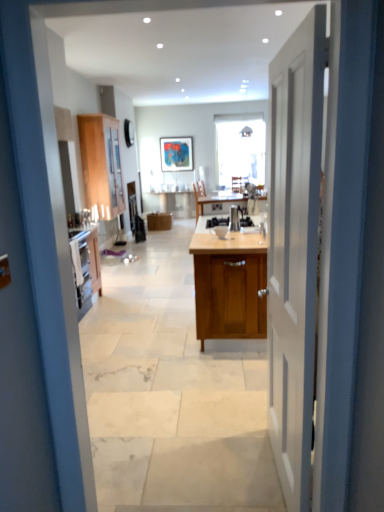
Question: Does point (87, 126) appear closer or farther from the camera than point (152, 224)?

Choices:
 (A) closer
 (B) farther

Answer: (A)

Question: Based on their sizes in the image, would you say wooden cabinet at left, the first cabinetry from the left, is bigger or smaller than wooden cabinet at center, the 1th cabinetry viewed from the back?

Choices:
 (A) small
 (B) big

Answer: (B)

Question: Which object is positioned closest to the wooden cabinet at center, the second cabinetry when ordered from left to right?

Choices:
 (A) white wooden door at center
 (B) satin silver kettle at center
 (C) wooden chair at center
 (D) wooden cabinet at center
 (E) wooden cabinet at left, the first cabinetry from the left

Answer: (C)

Question: Based on their relative distances, which object is farther from the wooden chair at center?

Choices:
 (A) wooden cabinet at center, the second cabinetry when ordered from left to right
 (B) wooden cabinet at center, the 3th cabinetry viewed from the back
 (C) white wooden door at center
 (D) satin silver kettle at center
 (E) wooden cabinet at left, the first cabinetry from the left

Answer: (C)